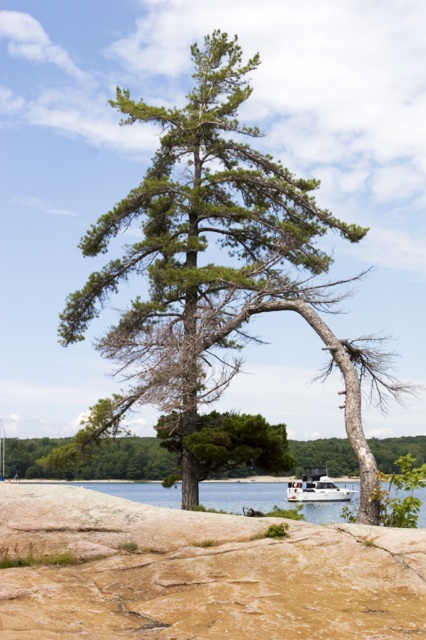
Between point (132, 326) and point (222, 509), which one is positioned behind?

Point (222, 509)

Between point (167, 384) and point (219, 486), which one is positioned in front?

Point (167, 384)

Describe the element at coordinates (216, 268) in the screenshot. I see `green needle-like foliage at center` at that location.

This screenshot has height=640, width=426. In order to click on green needle-like foliage at center in this screenshot , I will do `click(216, 268)`.

Does green needle-like foliage at center appear over green textured pine tree at center?

Yes, green needle-like foliage at center is above green textured pine tree at center.

Is green needle-like foliage at center taller than green textured pine tree at center?

Yes, green needle-like foliage at center is taller than green textured pine tree at center.

Is point (147, 182) farther from camera compared to point (120, 438)?

No, (147, 182) is closer to viewer.

At what (x,y) coordinates should I click in order to perform the action: click on green needle-like foliage at center. Please return your answer as a coordinate pair (x, y). Image resolution: width=426 pixels, height=640 pixels. Looking at the image, I should click on (216, 268).

Which is more to the left, green needle-like foliage at center or white matte boat at lower center?

From the viewer's perspective, green needle-like foliage at center appears more on the left side.

Is point (250, 205) closer to viewer compared to point (304, 496)?

Yes, point (250, 205) is in front of point (304, 496).

Who is more forward, (239, 148) or (321, 490)?

Point (239, 148) is more forward.

Locate an element on the screen. green needle-like foliage at center is located at coordinates (216, 268).